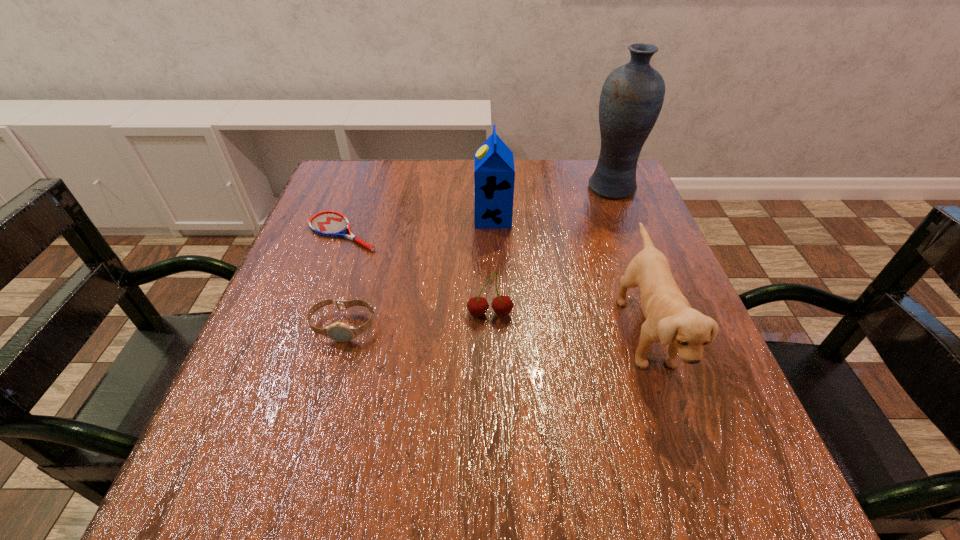
This screenshot has width=960, height=540. I want to click on the tallest object, so click(632, 96).

This screenshot has height=540, width=960. I want to click on vase, so click(632, 96).

Image resolution: width=960 pixels, height=540 pixels. Find the location of `carton`. carton is located at coordinates (494, 173).

This screenshot has height=540, width=960. In order to click on the third tallest object in this screenshot , I will do `click(670, 319)`.

In order to click on the third shortest object in this screenshot , I will do `click(502, 305)`.

Where is `the fifth tallest object`? Image resolution: width=960 pixels, height=540 pixels. the fifth tallest object is located at coordinates [341, 332].

You are a GUI agent. You are given a task and a screenshot of the screen. Output one action in this format:
    pyautogui.click(x=<x>, y=<y>)
    Task: Click on the tennis racket
    
    Given the screenshot: What is the action you would take?
    pyautogui.click(x=327, y=223)

Find the location of a particular element. blank space located 0.120m on the left of the vase is located at coordinates (538, 187).

Where is `vacant area situated 0.310m with the cap open on the carton`? The image size is (960, 540). vacant area situated 0.310m with the cap open on the carton is located at coordinates (343, 218).

The height and width of the screenshot is (540, 960). Find the location of `vacant space located 0.310m with the cap open on the carton`. vacant space located 0.310m with the cap open on the carton is located at coordinates (343, 218).